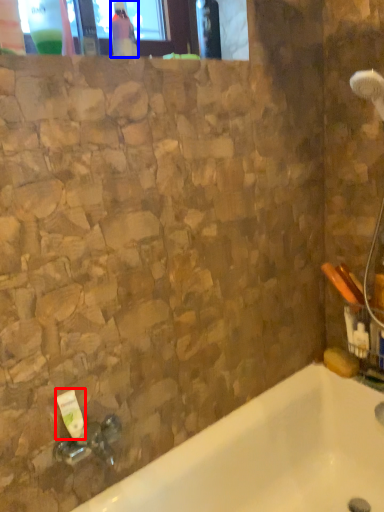
Question: Among these objects, which one is farthest to the camera, toiletry (highlighted by a red box) or bottle (highlighted by a blue box)?

Choices:
 (A) toiletry
 (B) bottle

Answer: (B)